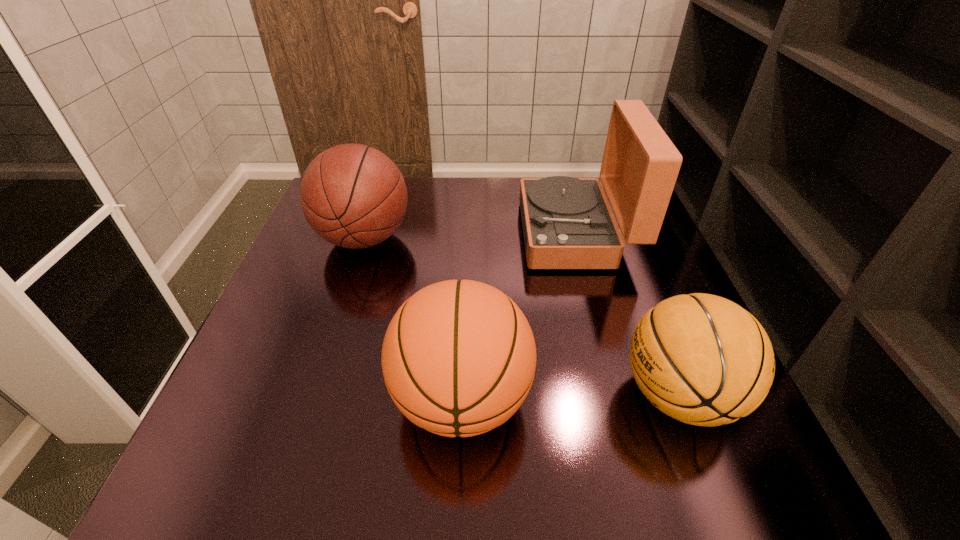
Point out which object is positioned as the second nearest to the phonograph record. Please provide its 2D coordinates. Your answer should be formatted as a tuple, i.e. [(x, y)], where the tuple contains the x and y coordinates of a point satisfying the conditions above.

[(702, 359)]

Select which basketball is the closest to the shortest object. Please provide its 2D coordinates. Your answer should be formatted as a tuple, i.e. [(x, y)], where the tuple contains the x and y coordinates of a point satisfying the conditions above.

[(458, 358)]

At what (x,y) coordinates should I click in order to perform the action: click on basketball that is the second closest one to the second basketball from right to left. Please return your answer as a coordinate pair (x, y). This screenshot has width=960, height=540. Looking at the image, I should click on (354, 196).

The image size is (960, 540). Find the location of `vacant space that satisfies the following two spatial constraints: 1. on the face of the phonograph record; 2. on the front side of the second basketball from left to right`. vacant space that satisfies the following two spatial constraints: 1. on the face of the phonograph record; 2. on the front side of the second basketball from left to right is located at coordinates (621, 399).